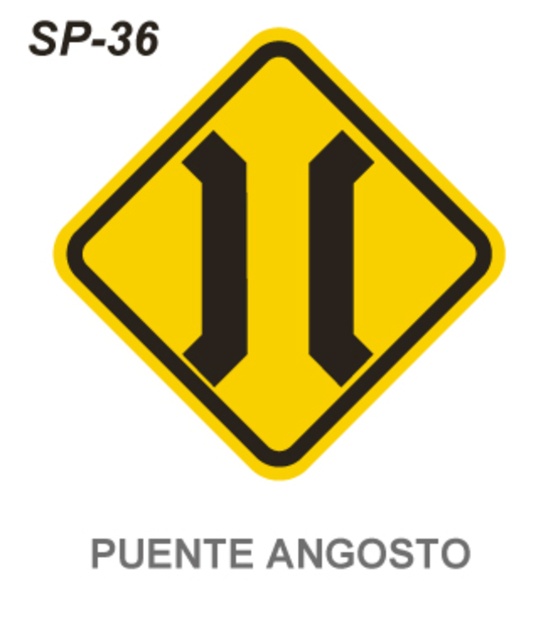
Question: Which point appears farthest from the camera in this image?

Choices:
 (A) (258, 416)
 (B) (137, 40)

Answer: (A)

Question: From the image, what is the correct spatial relationship of yellow matte road sign at center in relation to black text at upper left?

Choices:
 (A) below
 (B) above

Answer: (A)

Question: Which of the following is the closest to the observer?

Choices:
 (A) yellow matte road sign at center
 (B) black text at upper left

Answer: (B)

Question: Can you confirm if yellow matte road sign at center is bigger than black text at upper left?

Choices:
 (A) no
 (B) yes

Answer: (B)

Question: Does yellow matte road sign at center have a greater width compared to black text at upper left?

Choices:
 (A) yes
 (B) no

Answer: (A)